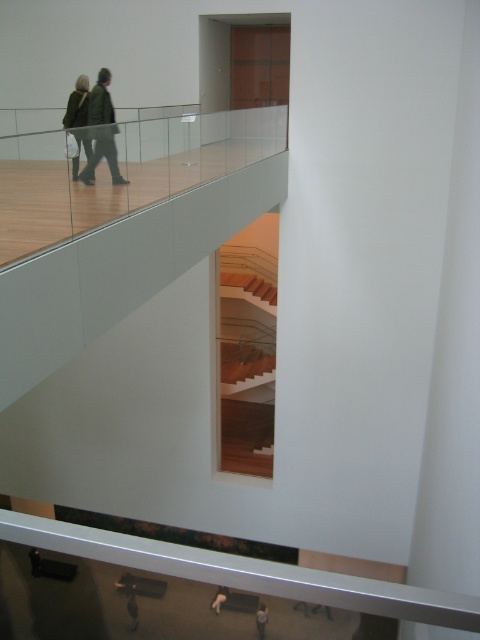
Question: Which object is positioned farthest from the green wool coat at upper left?

Choices:
 (A) green fabric jacket at upper left
 (B) white matte jacket at lower center
 (C) dark gray fabric pants at lower center

Answer: (B)

Question: Which point is closer to the camera taking this photo?

Choices:
 (A) (264, 632)
 (B) (216, 608)
 (C) (245, 376)
 (D) (83, 141)

Answer: (D)

Question: Does green wool coat at upper left come in front of white matte jacket at lower center?

Choices:
 (A) yes
 (B) no

Answer: (A)

Question: Does green wool coat at upper left appear under green fabric jacket at upper left?

Choices:
 (A) no
 (B) yes

Answer: (A)

Question: Among these objects, which one is farthest from the camera?

Choices:
 (A) dark gray fabric pants at lower center
 (B) green wool coat at upper left
 (C) green fabric jacket at upper left
 (D) white matte jacket at lower center

Answer: (D)

Question: Can you confirm if green wool coat at upper left is thinner than green fabric jacket at upper left?

Choices:
 (A) yes
 (B) no

Answer: (A)